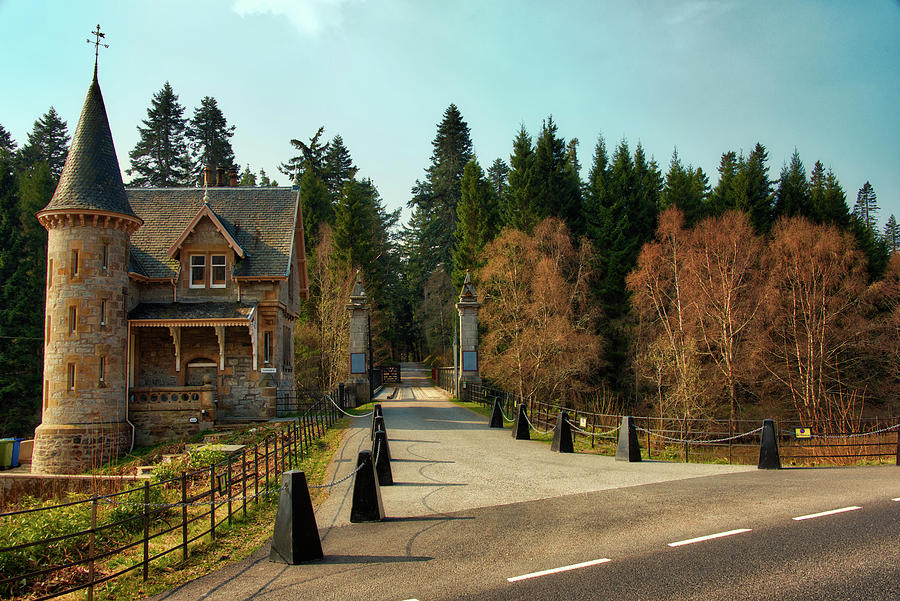
The height and width of the screenshot is (601, 900). I want to click on door, so click(x=195, y=377).